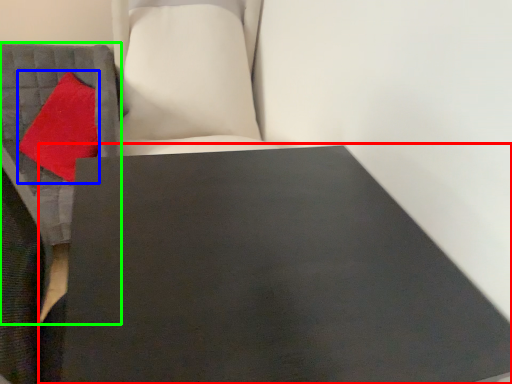
Question: Which is nearer to the table (highlighted by a red box)? throw pillow (highlighted by a blue box) or furniture (highlighted by a green box).

Choices:
 (A) throw pillow
 (B) furniture

Answer: (B)